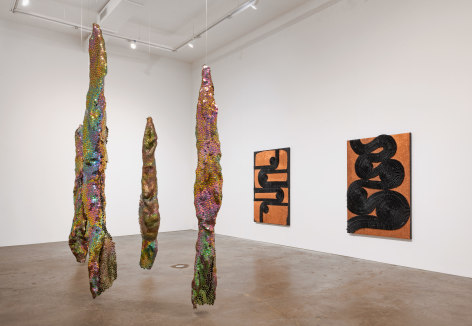
Where is `floor`? The height and width of the screenshot is (326, 472). floor is located at coordinates (131, 287).